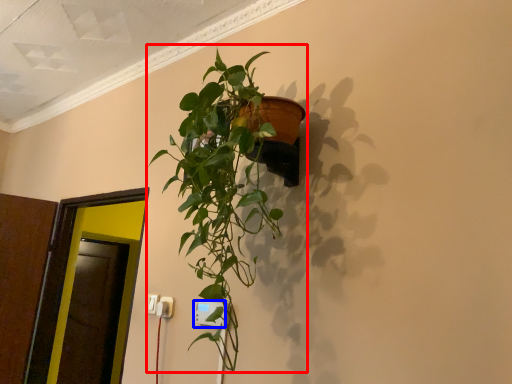
Question: Which point is closer to the camera, houseplant (highlighted by a red box) or electric outlet (highlighted by a blue box)?

Choices:
 (A) houseplant
 (B) electric outlet

Answer: (A)